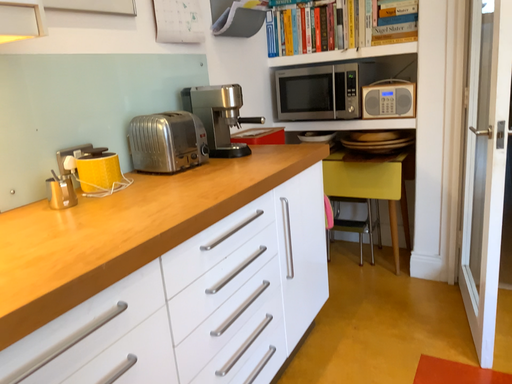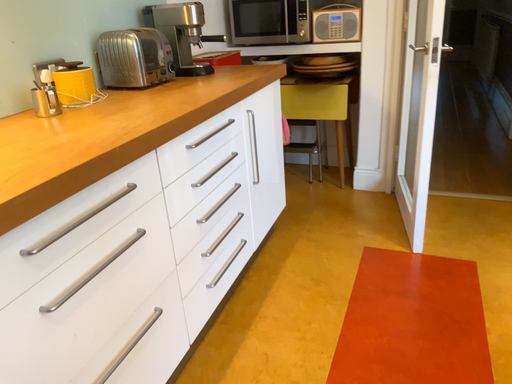
Question: How did the camera likely rotate when shooting the video?

Choices:
 (A) rotated right
 (B) rotated left

Answer: (A)